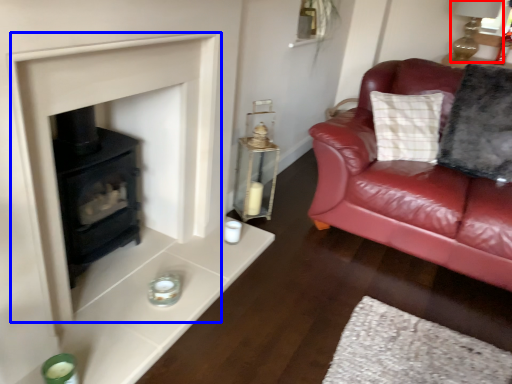
Question: Which point is further to the camera, oil lamp (highlighted by a red box) or fireplace (highlighted by a blue box)?

Choices:
 (A) oil lamp
 (B) fireplace

Answer: (A)